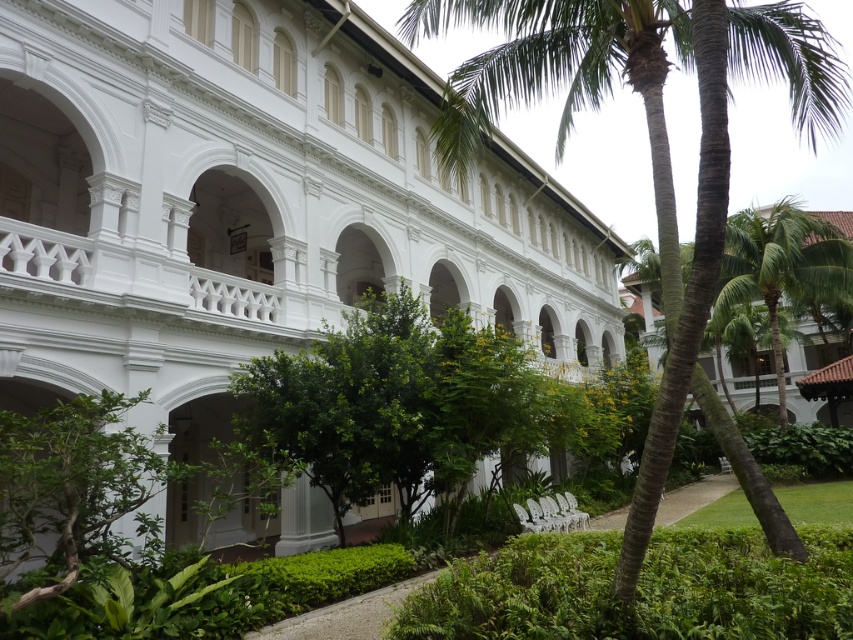
Question: Which object appears closest to the camera in this image?

Choices:
 (A) white smooth building at center
 (B) green textured palm tree at center

Answer: (B)

Question: Is white smooth building at center to the right of green textured palm tree at center from the viewer's perspective?

Choices:
 (A) no
 (B) yes

Answer: (A)

Question: Is white smooth building at center thinner than green textured palm tree at center?

Choices:
 (A) no
 (B) yes

Answer: (B)

Question: Is white smooth building at center behind green textured palm tree at center?

Choices:
 (A) yes
 (B) no

Answer: (A)

Question: Which of the following is the closest to the observer?

Choices:
 (A) (283, 36)
 (B) (711, 410)

Answer: (B)